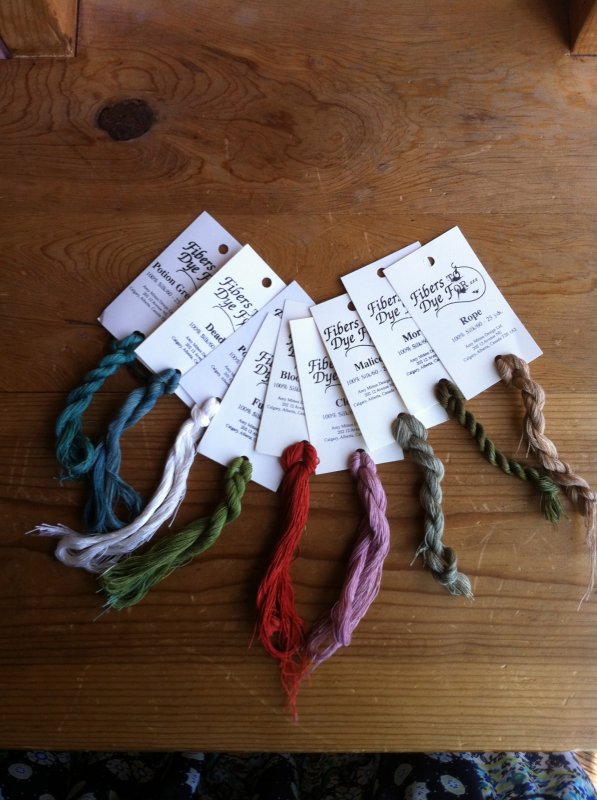
At what (x,y) coordinates should I click in order to perform the action: click on table. Please return your answer as a coordinate pair (x, y). Looking at the image, I should click on (344, 174).